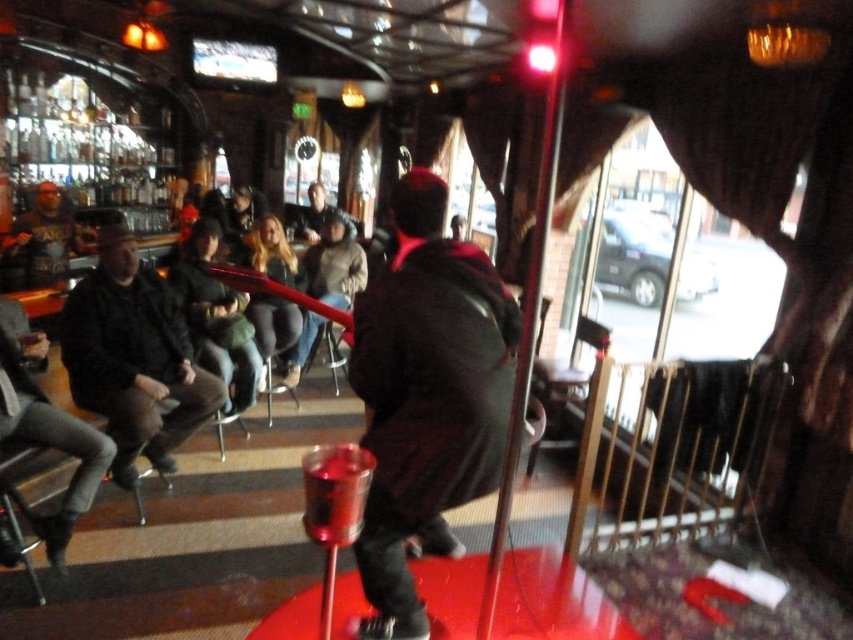
Question: Can you confirm if dark brown leather jacket at left is smaller than matte black jacket at left?

Choices:
 (A) yes
 (B) no

Answer: (A)

Question: Does dark brown leather jacket at center have a smaller size compared to matte black jacket at left?

Choices:
 (A) yes
 (B) no

Answer: (A)

Question: Which of the following is the farthest from the observer?

Choices:
 (A) dark brown leather jacket at center
 (B) dark brown leather jacket at left
 (C) matte black jacket at left

Answer: (C)

Question: Which of the following is the farthest from the observer?

Choices:
 (A) dark brown leather jacket at left
 (B) dark brown leather jacket at center

Answer: (A)

Question: Which object is positioned farthest from the dark brown leather jacket at center?

Choices:
 (A) matte black jacket at left
 (B) dark brown leather jacket at left

Answer: (A)

Question: Is dark brown leather jacket at center closer to the viewer compared to dark brown leather jacket at left?

Choices:
 (A) yes
 (B) no

Answer: (A)